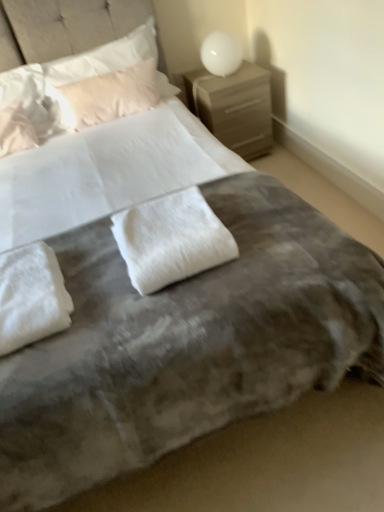
Measure the distance between white soft pillow at upper left, placed as the second pillow when sorted from back to front, and camera.

The distance of white soft pillow at upper left, placed as the second pillow when sorted from back to front, from camera is 7.42 feet.

The width and height of the screenshot is (384, 512). I want to click on white fluffy pillow at upper left, marked as the third pillow in a back-to-front arrangement, so click(23, 110).

This screenshot has width=384, height=512. What do you see at coordinates (171, 239) in the screenshot?
I see `white fluffy pillow at center, the 5th pillow viewed from the back` at bounding box center [171, 239].

Identify the location of light pink satin pillow at upper left, which is counted as the 1th pillow, starting from the back. This screenshot has height=512, width=384. (104, 96).

How much space does light pink satin pillow at upper left, the sixth pillow positioned from the front, occupy horizontally?

17.30 centimeters.

Where is `white fluffy pillow at lower left, which is counted as the 1th pillow, starting from the front`? Image resolution: width=384 pixels, height=512 pixels. white fluffy pillow at lower left, which is counted as the 1th pillow, starting from the front is located at coordinates (31, 296).

From a real-world perspective, is white fluffy pillow at upper left, which ranks as the fourth pillow in back-to-front order, physically located above or below white fluffy pillow at center, positioned as the second pillow in front-to-back order?

white fluffy pillow at upper left, which ranks as the fourth pillow in back-to-front order, is situated higher than white fluffy pillow at center, positioned as the second pillow in front-to-back order, in the real world.

What's the angular difference between white fluffy pillow at upper left, which ranks as the fourth pillow in back-to-front order, and white fluffy pillow at center, positioned as the second pillow in front-to-back order,'s facing directions?

The facing directions of white fluffy pillow at upper left, which ranks as the fourth pillow in back-to-front order, and white fluffy pillow at center, positioned as the second pillow in front-to-back order, are 6.94 degrees apart.

Is white fluffy pillow at upper left, the third pillow from the front, closer to the viewer compared to white fluffy pillow at center, positioned as the second pillow in front-to-back order?

No, the depth of white fluffy pillow at upper left, the third pillow from the front, is greater than that of white fluffy pillow at center, positioned as the second pillow in front-to-back order.

Is point (23, 141) more distant than point (170, 230)?

Yes, point (23, 141) is farther from viewer.

Which is behind, point (161, 78) or point (6, 124)?

The point (161, 78) is farther.

Considering the sizes of objects white soft pillow at upper left, placed as the second pillow when sorted from back to front, and white fluffy pillow at upper left, the third pillow from the front, in the image provided, who is thinner, white soft pillow at upper left, placed as the second pillow when sorted from back to front, or white fluffy pillow at upper left, the third pillow from the front,?

white soft pillow at upper left, placed as the second pillow when sorted from back to front.

Are white soft pillow at upper left, the 5th pillow when ordered from front to back, and white fluffy pillow at upper left, the third pillow from the front, making contact?

There is a gap between white soft pillow at upper left, the 5th pillow when ordered from front to back, and white fluffy pillow at upper left, the third pillow from the front.

In the scene shown: Does white soft pillow at upper left, placed as the second pillow when sorted from back to front, lie behind white fluffy pillow at upper left, the third pillow from the front?

Yes, it is.

Can you confirm if matte beige nightstand at upper right is smaller than white fluffy pillow at lower left, which is counted as the 1th pillow, starting from the front?

No.

Considering the relative sizes of matte beige nightstand at upper right and white fluffy pillow at lower left, which is counted as the 1th pillow, starting from the front, in the image provided, is matte beige nightstand at upper right thinner than white fluffy pillow at lower left, which is counted as the 1th pillow, starting from the front,?

In fact, matte beige nightstand at upper right might be wider than white fluffy pillow at lower left, which is counted as the 1th pillow, starting from the front.

Locate an element on the screen. The width and height of the screenshot is (384, 512). nightstand beneath the white fluffy pillow at lower left, which is counted as the 1th pillow, starting from the front (from a real-world perspective) is located at coordinates (234, 106).

Based on the photo, is white fluffy pillow at lower left, the 6th pillow positioned from the back, behind white glossy sphere at upper right?

No.

Considering the sizes of objects white fluffy pillow at lower left, the 6th pillow positioned from the back, and white glossy sphere at upper right in the image provided, who is bigger, white fluffy pillow at lower left, the 6th pillow positioned from the back, or white glossy sphere at upper right?

With larger size is white glossy sphere at upper right.

Where is `pillow that is the 4th object directly below the white glossy sphere at upper right (from a real-world perspective)`? The image size is (384, 512). pillow that is the 4th object directly below the white glossy sphere at upper right (from a real-world perspective) is located at coordinates (31, 296).

What's the angular difference between white fluffy pillow at lower left, the 6th pillow positioned from the back, and white glossy sphere at upper right's facing directions?

The angular difference between white fluffy pillow at lower left, the 6th pillow positioned from the back, and white glossy sphere at upper right is 1.62 degrees.

Considering the relative sizes of white soft pillow at upper left, placed as the second pillow when sorted from back to front, and white glossy sphere at upper right in the image provided, is white soft pillow at upper left, placed as the second pillow when sorted from back to front, bigger than white glossy sphere at upper right?

Indeed, white soft pillow at upper left, placed as the second pillow when sorted from back to front, has a larger size compared to white glossy sphere at upper right.

Could white glossy sphere at upper right be considered to be inside white soft pillow at upper left, placed as the second pillow when sorted from back to front?

No, white glossy sphere at upper right is not a part of white soft pillow at upper left, placed as the second pillow when sorted from back to front.

Who is shorter, white soft pillow at upper left, the 5th pillow when ordered from front to back, or white glossy sphere at upper right?

Standing shorter between the two is white glossy sphere at upper right.

Between white soft pillow at upper left, the 5th pillow when ordered from front to back, and light pink satin pillow at upper left, the sixth pillow positioned from the front, which one appears on the left side from the viewer's perspective?

white soft pillow at upper left, the 5th pillow when ordered from front to back.

How different are the orientations of white soft pillow at upper left, the 5th pillow when ordered from front to back, and light pink satin pillow at upper left, the sixth pillow positioned from the front, in degrees?

white soft pillow at upper left, the 5th pillow when ordered from front to back, and light pink satin pillow at upper left, the sixth pillow positioned from the front, are facing 7.23 degrees away from each other.

From a real-world perspective, count 2nd pillows downward from the white soft pillow at upper left, placed as the second pillow when sorted from back to front, and point to it. Please provide its 2D coordinates.

[(104, 96)]

How far apart are white soft pillow at upper left, the 5th pillow when ordered from front to back, and light pink satin pillow at upper left, the sixth pillow positioned from the front?

A distance of 10.32 centimeters exists between white soft pillow at upper left, the 5th pillow when ordered from front to back, and light pink satin pillow at upper left, the sixth pillow positioned from the front.

From a real-world perspective, is white glossy sphere at upper right positioned under white soft pillow at upper left, the 5th pillow when ordered from front to back, based on gravity?

Yes.

The height and width of the screenshot is (512, 384). In order to click on bedside lamp above the white soft pillow at upper left, the 5th pillow when ordered from front to back (from the image's perspective) in this screenshot , I will do `click(221, 53)`.

Which of these two, white glossy sphere at upper right or white soft pillow at upper left, placed as the second pillow when sorted from back to front, is wider?

With larger width is white glossy sphere at upper right.

Starting from the white fluffy pillow at center, the 5th pillow viewed from the back, which pillow is the 5th one to the left? Please provide its 2D coordinates.

[(16, 130)]

From the white fluffy pillow at upper left, the third pillow from the front, count 2nd pillows backward and point to it. Please provide its 2D coordinates.

[(71, 78)]

Based on the photo, from the image, which object appears to be farther from white soft pillow at upper left, the 5th pillow when ordered from front to back, white fluffy pillow at upper left, positioned as the 4th pillow in front-to-back order, or light pink satin pillow at upper left, the sixth pillow positioned from the front?

Among the two, white fluffy pillow at upper left, positioned as the 4th pillow in front-to-back order, is located further to white soft pillow at upper left, the 5th pillow when ordered from front to back.

When comparing their distances from white fluffy pillow at upper left, which ranks as the fourth pillow in back-to-front order, does light pink satin pillow at upper left, the sixth pillow positioned from the front, or white fluffy pillow at lower left, the 6th pillow positioned from the back, seem closer?

Based on the image, light pink satin pillow at upper left, the sixth pillow positioned from the front, appears to be nearer to white fluffy pillow at upper left, which ranks as the fourth pillow in back-to-front order.

Looking at the image, which one is located closer to matte beige nightstand at upper right, white fluffy pillow at center, the 5th pillow viewed from the back, or white fluffy pillow at upper left, marked as the third pillow in a back-to-front arrangement?

white fluffy pillow at upper left, marked as the third pillow in a back-to-front arrangement, lies closer to matte beige nightstand at upper right than the other object.

Considering their positions, is white glossy sphere at upper right positioned closer to light pink satin pillow at upper left, which is counted as the 1th pillow, starting from the back, than white fluffy pillow at upper left, positioned as the 4th pillow in front-to-back order?

white fluffy pillow at upper left, positioned as the 4th pillow in front-to-back order, is positioned closer to the anchor light pink satin pillow at upper left, which is counted as the 1th pillow, starting from the back.

When comparing their distances from white fluffy pillow at upper left, positioned as the 4th pillow in front-to-back order, does white fluffy pillow at upper left, the third pillow from the front, or matte beige nightstand at upper right seem further?

Based on the image, matte beige nightstand at upper right appears to be further to white fluffy pillow at upper left, positioned as the 4th pillow in front-to-back order.

When comparing their distances from white fluffy pillow at lower left, which is counted as the 1th pillow, starting from the front, does white soft pillow at upper left, placed as the second pillow when sorted from back to front, or light pink satin pillow at upper left, the sixth pillow positioned from the front, seem further?

Based on the image, white soft pillow at upper left, placed as the second pillow when sorted from back to front, appears to be further to white fluffy pillow at lower left, which is counted as the 1th pillow, starting from the front.

When comparing their distances from light pink satin pillow at upper left, the sixth pillow positioned from the front, does white fluffy pillow at upper left, marked as the third pillow in a back-to-front arrangement, or white glossy sphere at upper right seem further?

white glossy sphere at upper right lies further to light pink satin pillow at upper left, the sixth pillow positioned from the front, than the other object.

Which object lies nearer to the anchor point light pink satin pillow at upper left, which is counted as the 1th pillow, starting from the back, white fluffy pillow at upper left, positioned as the 4th pillow in front-to-back order, or white fluffy pillow at upper left, the third pillow from the front?

white fluffy pillow at upper left, positioned as the 4th pillow in front-to-back order, is positioned closer to the anchor light pink satin pillow at upper left, which is counted as the 1th pillow, starting from the back.

This screenshot has width=384, height=512. Find the location of `bedside lamp between white soft pillow at upper left, placed as the second pillow when sorted from back to front, and matte beige nightstand at upper right from left to right`. bedside lamp between white soft pillow at upper left, placed as the second pillow when sorted from back to front, and matte beige nightstand at upper right from left to right is located at coordinates (221, 53).

Locate an element on the screen. The image size is (384, 512). pillow between white fluffy pillow at center, the 5th pillow viewed from the back, and white fluffy pillow at upper left, marked as the third pillow in a back-to-front arrangement, along the z-axis is located at coordinates (16, 130).

This screenshot has width=384, height=512. I want to click on pillow between white fluffy pillow at lower left, the 6th pillow positioned from the back, and white fluffy pillow at upper left, the third pillow from the front, along the z-axis, so click(x=171, y=239).

Find the location of a particular element. This screenshot has height=512, width=384. bedside lamp positioned between white fluffy pillow at center, the 5th pillow viewed from the back, and matte beige nightstand at upper right from near to far is located at coordinates (221, 53).